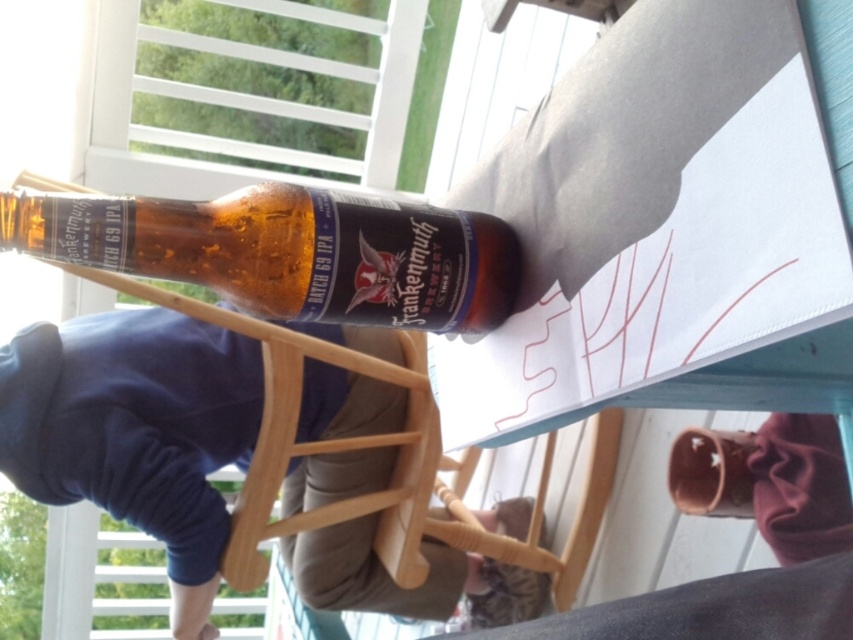
Question: Which point is closer to the camera taking this photo?

Choices:
 (A) (514, 259)
 (B) (668, 490)

Answer: (A)

Question: Estimate the real-world distances between objects in this image. Which object is farther from the translucent amber glass bottle at center?

Choices:
 (A) blue cotton pants at lower center
 (B) translucent glass cup at lower right

Answer: (A)

Question: Considering the relative positions of blue cotton pants at lower center and translucent amber glass bottle at center in the image provided, where is blue cotton pants at lower center located with respect to translucent amber glass bottle at center?

Choices:
 (A) below
 (B) above

Answer: (A)

Question: Can you confirm if blue cotton pants at lower center is smaller than translucent glass cup at lower right?

Choices:
 (A) no
 (B) yes

Answer: (A)

Question: Which object appears farthest from the camera in this image?

Choices:
 (A) translucent glass cup at lower right
 (B) blue cotton pants at lower center

Answer: (B)

Question: Can you confirm if blue cotton pants at lower center is positioned to the right of translucent glass cup at lower right?

Choices:
 (A) no
 (B) yes

Answer: (A)